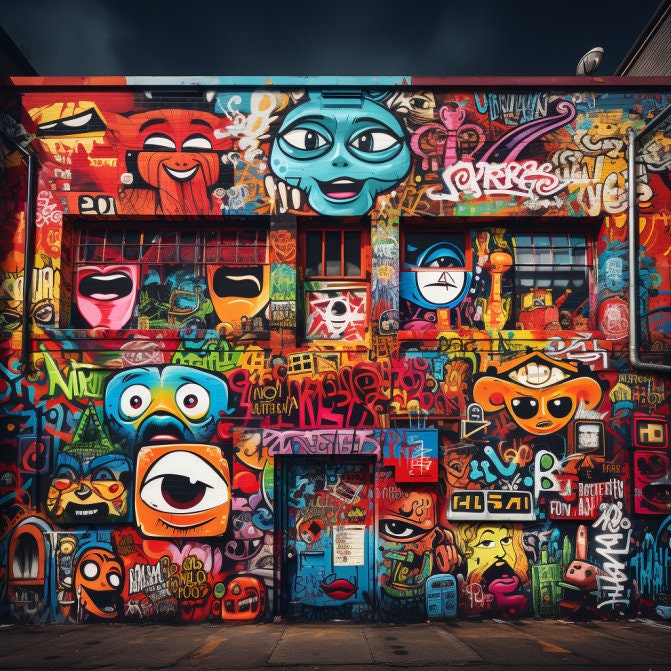
Where is `door`? This screenshot has height=671, width=671. door is located at coordinates (313, 578).